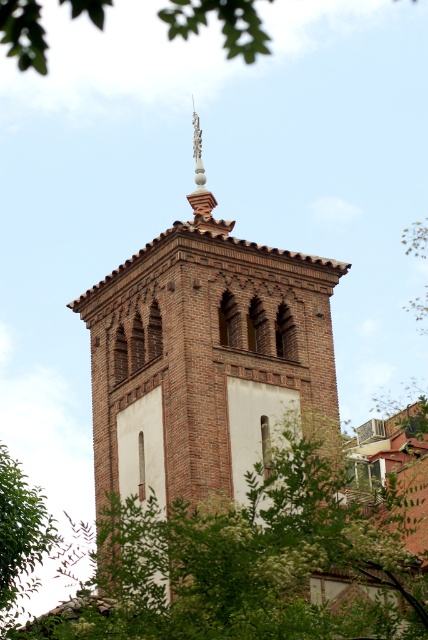
You are a bird flying over a historical site. You see the brown brick tower at center and the green leafy tree at center. Which one would you prefer to land on for a higher vantage point?

The brown brick tower at center is much taller than the green leafy tree at center, so the bird would prefer to land on the brown brick tower at center for a higher vantage point.

You are an architect analyzing the placement of trees around the brick tower. Given that both green leafy tree at upper left and green leafy tree at lower left are positioned near the tower, which one is closer to the top of the tower?

The green leafy tree at upper left is closer to the top of the tower because it is taller than the green leafy tree at lower left.

You are standing at point (205, 356) in the image. What object are you directly facing?

You are directly facing the brown brick tower at center located at point (205, 356).